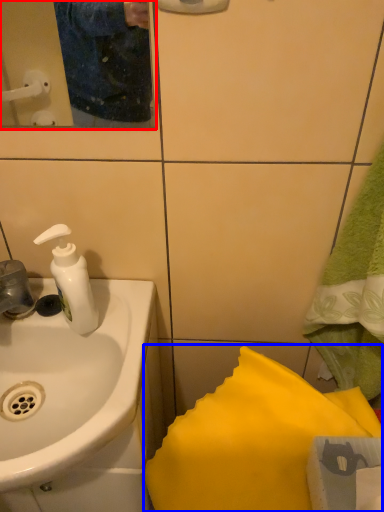
Question: Which of the following is the closest to the observer, mirror (highlighted by a red box) or bath towel (highlighted by a blue box)?

Choices:
 (A) mirror
 (B) bath towel

Answer: (A)